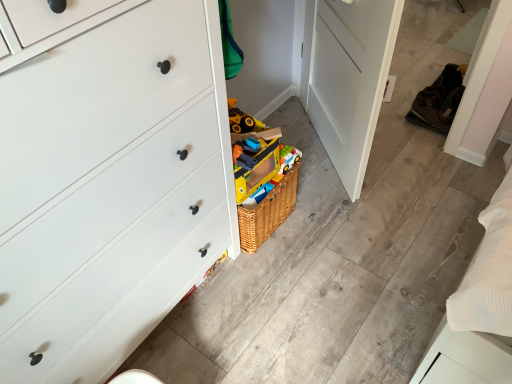
Question: Looking at the image, does brown leather shoe at right, which appears as the first shoe when viewed from the right, seem bigger or smaller compared to white matte chest of drawers at left?

Choices:
 (A) small
 (B) big

Answer: (A)

Question: Relative to white matte chest of drawers at left, is brown leather shoe at right, the 2th shoe in the left-to-right sequence, in front or behind?

Choices:
 (A) front
 (B) behind

Answer: (B)

Question: Based on their relative distances, which object is farther from the brown suede shoe at right, the first shoe in the left-to-right sequence?

Choices:
 (A) brown leather shoe at right, which appears as the first shoe when viewed from the right
 (B) white matte chest of drawers at left

Answer: (B)

Question: Estimate the real-world distances between objects in this image. Which object is closer to the brown suede shoe at right, the 2th shoe when ordered from right to left?

Choices:
 (A) white matte chest of drawers at left
 (B) brown leather shoe at right, which appears as the first shoe when viewed from the right

Answer: (B)